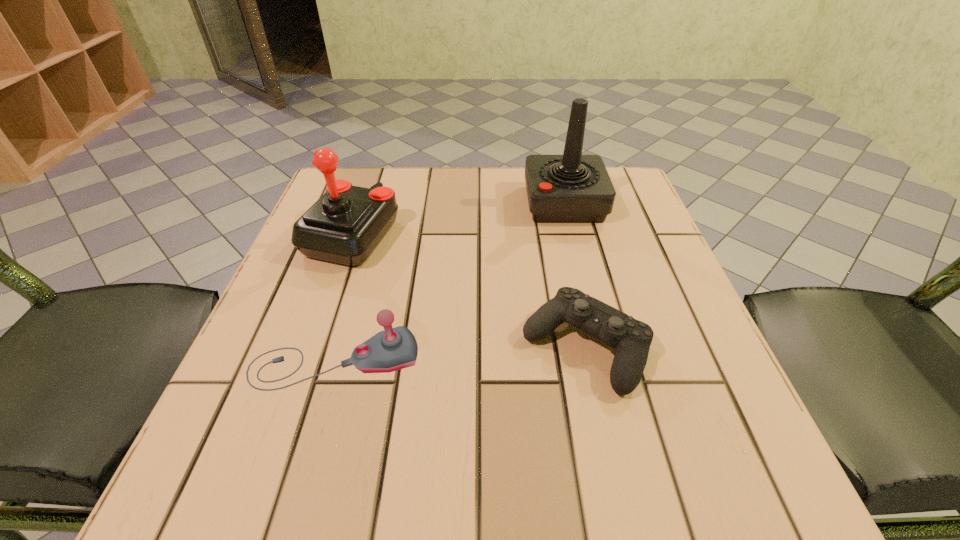
Locate an element on the screen. control located in the right edge section of the desktop is located at coordinates (631, 339).

Identify the location of object located at the far left corner. Image resolution: width=960 pixels, height=540 pixels. (345, 225).

The height and width of the screenshot is (540, 960). I want to click on object positioned at the far right corner, so click(571, 188).

Where is `free space at the far edge of the desktop`? free space at the far edge of the desktop is located at coordinates tap(487, 189).

Where is `vacant area at the near edge`? vacant area at the near edge is located at coordinates (512, 498).

Locate an element on the screen. The height and width of the screenshot is (540, 960). free space at the left edge of the desktop is located at coordinates (269, 428).

Where is `free space at the right edge of the desktop`? The height and width of the screenshot is (540, 960). free space at the right edge of the desktop is located at coordinates (684, 342).

Find the location of `free spot at the near left corner of the desktop`. free spot at the near left corner of the desktop is located at coordinates (265, 505).

In the image, there is a desktop. Where is `blank space at the far right corner`? This screenshot has height=540, width=960. blank space at the far right corner is located at coordinates (622, 194).

This screenshot has height=540, width=960. In order to click on blank area at the near right corner in this screenshot , I will do `click(715, 448)`.